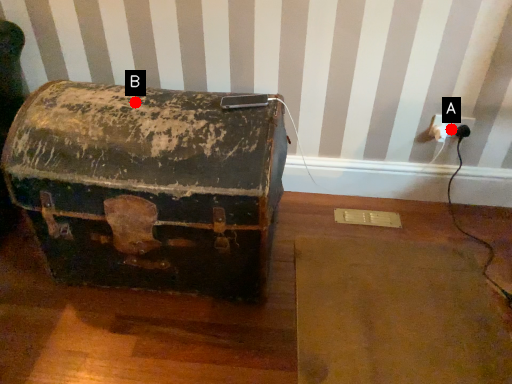
Question: Two points are circled on the image, labeled by A and B beside each circle. Which point is farther to the camera?

Choices:
 (A) A is further
 (B) B is further

Answer: (A)